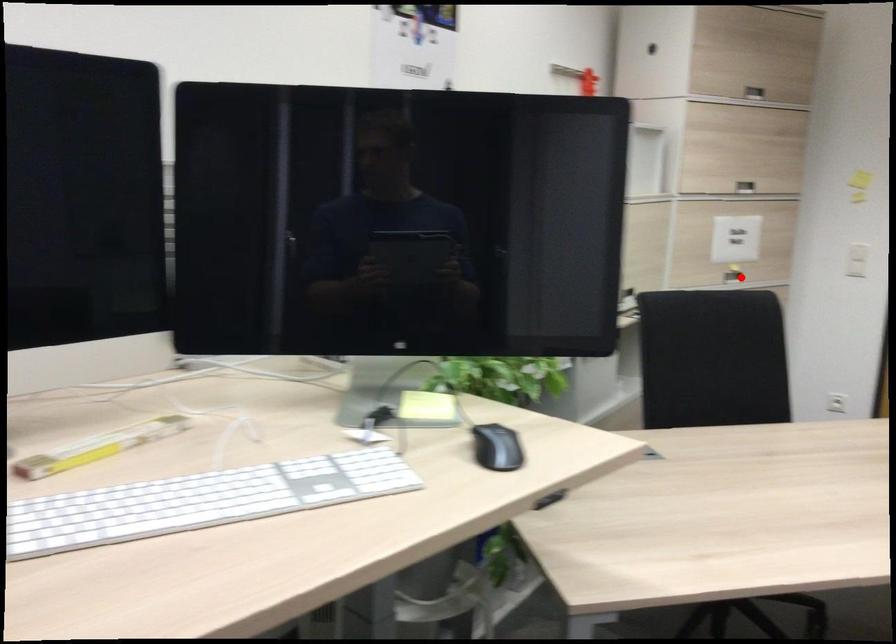
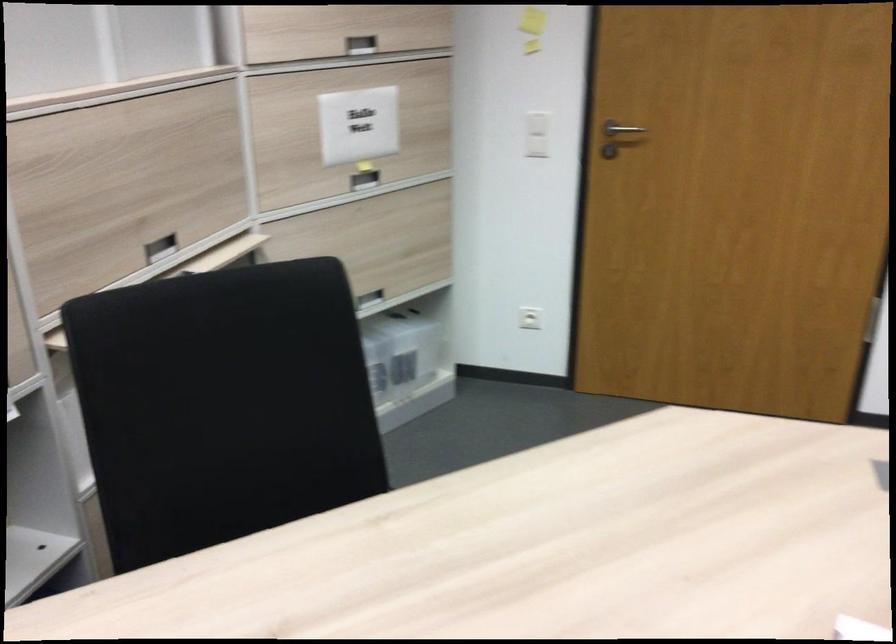
Find the pixel in the second image that matches the highlighted location in the first image.

(364, 180)